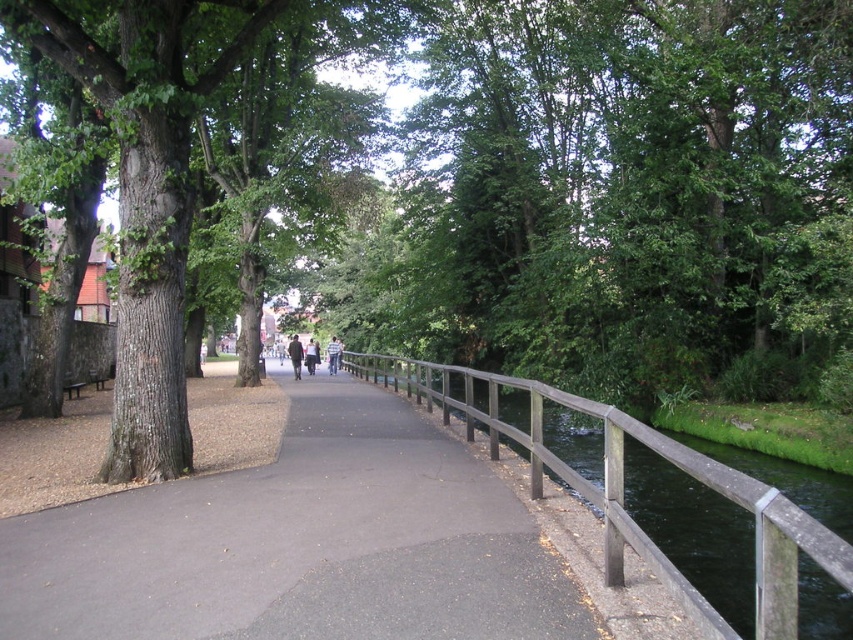
You are a hiker who just arrived at the pathway and see both the dark gray jacket at center and the light brown leather jacket at center. You want to pick up the jacket that is on top. Which jacket should you pick?

The dark gray jacket at center is positioned over light brown leather jacket at center, so you should pick the dark gray jacket at center as it is on top.

You are standing at the point marked by coordinates point (299,545) in the image. What material are you standing on?

You are standing on dark gray asphalt at center as indicated by the coordinates point (299,545).

You are standing at the point marked by the coordinates point (299, 545) in the image. What material are you currently standing on?

The dark gray asphalt at center is located at point (299, 545), so you are standing on dark gray asphalt at center.